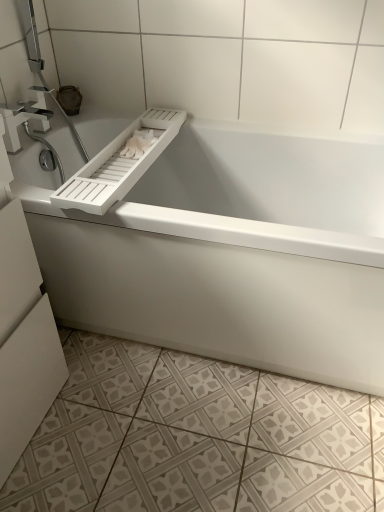
Question: From the image's perspective, would you say white matte bathtub at center is shown under white textured tile at lower center?

Choices:
 (A) no
 (B) yes

Answer: (A)

Question: Does white matte bathtub at center have a lesser width compared to white textured tile at lower center?

Choices:
 (A) no
 (B) yes

Answer: (B)

Question: Is white matte bathtub at center at the right side of white textured tile at lower center?

Choices:
 (A) no
 (B) yes

Answer: (B)

Question: Is white matte bathtub at center not near white textured tile at lower center?

Choices:
 (A) no
 (B) yes

Answer: (A)

Question: Is white textured tile at lower center at the back of white matte bathtub at center?

Choices:
 (A) no
 (B) yes

Answer: (A)

Question: Is white matte toilet paper at upper center in front of or behind white matte bathtub at center in the image?

Choices:
 (A) front
 (B) behind

Answer: (B)

Question: Is white matte toilet paper at upper center bigger or smaller than white matte bathtub at center?

Choices:
 (A) small
 (B) big

Answer: (A)

Question: From a real-world perspective, is white matte toilet paper at upper center physically located above or below white matte bathtub at center?

Choices:
 (A) below
 (B) above

Answer: (B)

Question: Is white matte toilet paper at upper center taller or shorter than white matte bathtub at center?

Choices:
 (A) short
 (B) tall

Answer: (A)

Question: Does point (3, 106) appear closer or farther from the camera than point (331, 411)?

Choices:
 (A) closer
 (B) farther

Answer: (B)

Question: Is satin nickel faucet at upper left bigger or smaller than white textured tile at lower center?

Choices:
 (A) big
 (B) small

Answer: (B)

Question: In the image, is satin nickel faucet at upper left positioned in front of or behind white textured tile at lower center?

Choices:
 (A) behind
 (B) front

Answer: (A)

Question: From the image's perspective, relative to white textured tile at lower center, is satin nickel faucet at upper left above or below?

Choices:
 (A) below
 (B) above

Answer: (B)

Question: Looking at their shapes, would you say satin nickel faucet at upper left is wider or thinner than white matte toilet paper at upper center?

Choices:
 (A) wide
 (B) thin

Answer: (B)

Question: From a real-world perspective, relative to white matte toilet paper at upper center, is satin nickel faucet at upper left vertically above or below?

Choices:
 (A) below
 (B) above

Answer: (B)